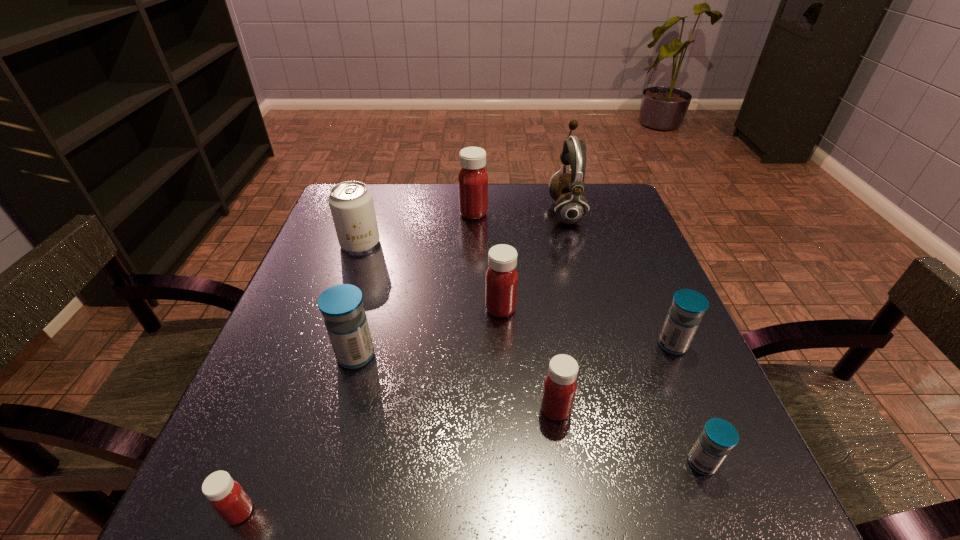
Locate an element on the screen. free space between the earphone and the biggest blue medicine is located at coordinates (461, 283).

Identify the location of free area in between the leftmost blue medicine and the third smallest red medicine. This screenshot has width=960, height=540. (428, 332).

Image resolution: width=960 pixels, height=540 pixels. In order to click on vacant area that lies between the second medicine from left to right and the tallest medicine in this screenshot , I will do `click(415, 285)`.

The width and height of the screenshot is (960, 540). Find the location of `free space between the sixth nearest object and the rightmost red medicine`. free space between the sixth nearest object and the rightmost red medicine is located at coordinates (528, 359).

Where is `vacant area between the leftmost medicine and the third nearest red medicine`? vacant area between the leftmost medicine and the third nearest red medicine is located at coordinates (370, 410).

Find the location of a particular element. The width and height of the screenshot is (960, 540). blank region between the soda can and the second nearest medicine is located at coordinates (531, 353).

Image resolution: width=960 pixels, height=540 pixels. Identify the location of vacant area that lies between the leftmost blue medicine and the farthest red medicine. (415, 285).

The image size is (960, 540). Find the location of `unoccupied area between the sixth object from left to right and the tallest medicine`. unoccupied area between the sixth object from left to right and the tallest medicine is located at coordinates (515, 312).

Find the location of a particular element. The width and height of the screenshot is (960, 540). empty space between the farthest red medicine and the second biggest blue medicine is located at coordinates (573, 279).

Where is `object that ranks as the eighth closest to the soda can`? Image resolution: width=960 pixels, height=540 pixels. object that ranks as the eighth closest to the soda can is located at coordinates pyautogui.click(x=718, y=437).